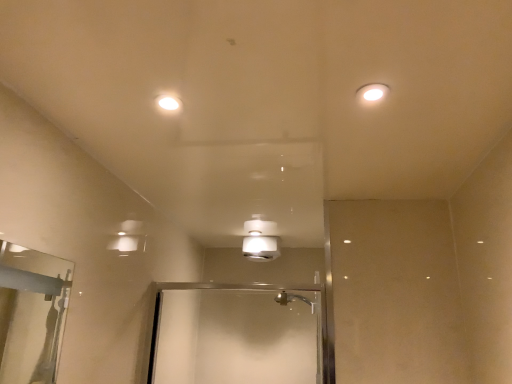
Question: Which direction should I rotate to face white glossy light fixture at center, which is the 2th light fixture from top to bottom, — up or down?

Choices:
 (A) up
 (B) down

Answer: (B)

Question: Is white glossy light fixture at center, the second light fixture from the right, at the back of white glossy light fixture at upper right, the second light fixture in the bottom-to-top sequence?

Choices:
 (A) yes
 (B) no

Answer: (A)

Question: Is white glossy light fixture at upper right, the 2th light fixture positioned from the left, closer to camera compared to white glossy light fixture at center, the first light fixture when ordered from left to right?

Choices:
 (A) yes
 (B) no

Answer: (A)

Question: Is white glossy light fixture at center, which appears as the first light fixture when viewed from the back, inside white glossy light fixture at upper right, the 2th light fixture positioned from the left?

Choices:
 (A) yes
 (B) no

Answer: (B)

Question: Is white glossy light fixture at upper right, the second light fixture in the bottom-to-top sequence, facing towards white glossy light fixture at center, which ranks as the 1th light fixture in bottom-to-top order?

Choices:
 (A) no
 (B) yes

Answer: (A)

Question: Is white glossy light fixture at upper right, the 1th light fixture positioned from the front, not inside white glossy light fixture at center, which is counted as the second light fixture, starting from the front?

Choices:
 (A) yes
 (B) no

Answer: (A)

Question: Can you confirm if white glossy light fixture at upper right, arranged as the first light fixture when viewed from the right, is bigger than white glossy light fixture at center, which appears as the first light fixture when viewed from the back?

Choices:
 (A) no
 (B) yes

Answer: (A)

Question: Considering the relative sizes of white glossy light fixture at center, which ranks as the 1th light fixture in bottom-to-top order, and white glossy light fixture at upper right, the second light fixture in the bottom-to-top sequence, in the image provided, is white glossy light fixture at center, which ranks as the 1th light fixture in bottom-to-top order, shorter than white glossy light fixture at upper right, the second light fixture in the bottom-to-top sequence,?

Choices:
 (A) no
 (B) yes

Answer: (A)

Question: From a real-world perspective, is white glossy light fixture at center, which is counted as the second light fixture, starting from the front, physically below white glossy light fixture at upper right, the 2th light fixture positioned from the left?

Choices:
 (A) no
 (B) yes

Answer: (B)

Question: Is white glossy light fixture at center, which appears as the first light fixture when viewed from the back, behind white glossy light fixture at upper right, which is the 1th light fixture in top-to-bottom order?

Choices:
 (A) no
 (B) yes

Answer: (B)

Question: Is white glossy light fixture at upper right, the second light fixture in the bottom-to-top sequence, a part of white glossy light fixture at center, which ranks as the 1th light fixture in bottom-to-top order?

Choices:
 (A) yes
 (B) no

Answer: (B)

Question: From a real-world perspective, is white glossy light fixture at center, which is the 2th light fixture from top to bottom, located higher than white glossy light fixture at upper right, the second light fixture in the bottom-to-top sequence?

Choices:
 (A) no
 (B) yes

Answer: (A)

Question: Is white glossy light fixture at center, which is counted as the second light fixture, starting from the front, at the right side of white glossy light fixture at upper right, arranged as the first light fixture when viewed from the right?

Choices:
 (A) yes
 (B) no

Answer: (B)

Question: Is white glossy light fixture at upper right, the second light fixture in the bottom-to-top sequence, wider or thinner than white glossy light fixture at center, which appears as the first light fixture when viewed from the back?

Choices:
 (A) wide
 (B) thin

Answer: (B)